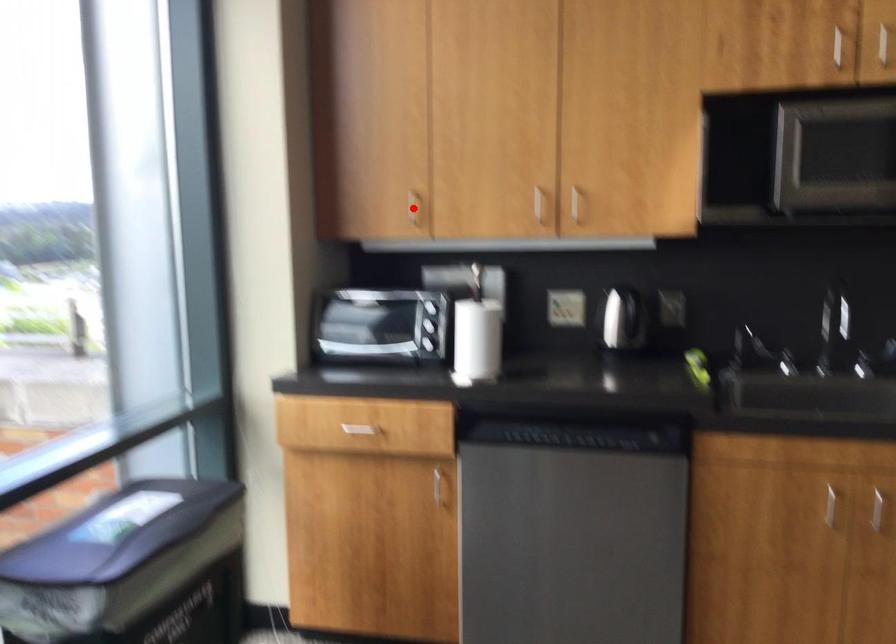
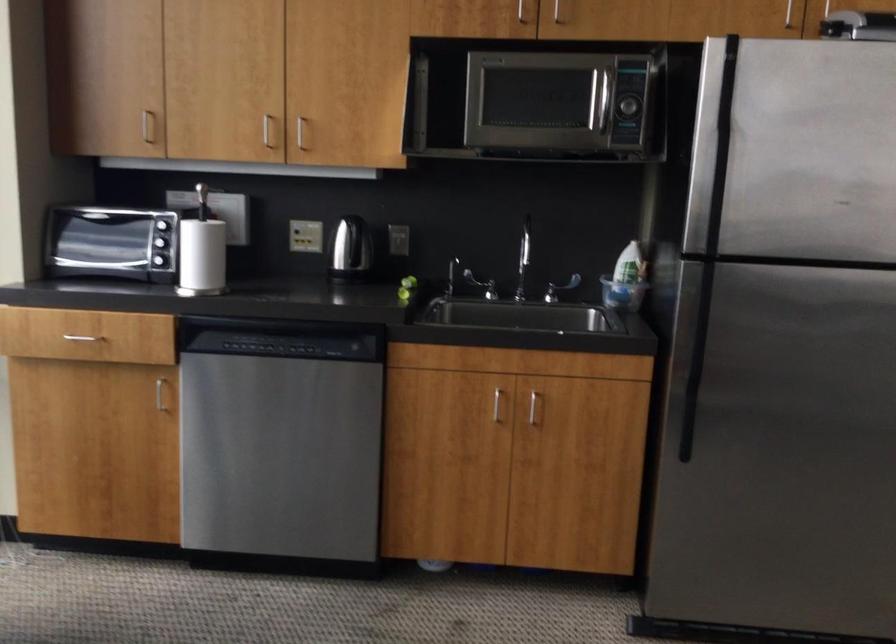
Question: I am providing you with two images of the same scene from different viewpoints. A red point is marked on the first image. Can you still see the location of the red point in image 2?

Choices:
 (A) Yes
 (B) No

Answer: (A)